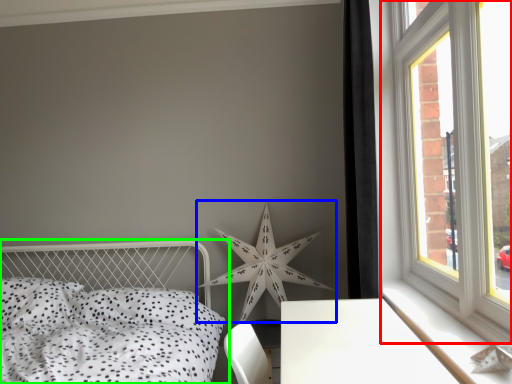
Question: Which is nearer to the window (highlighted by a red box)? star (highlighted by a blue box) or bed (highlighted by a green box).

Choices:
 (A) star
 (B) bed

Answer: (A)